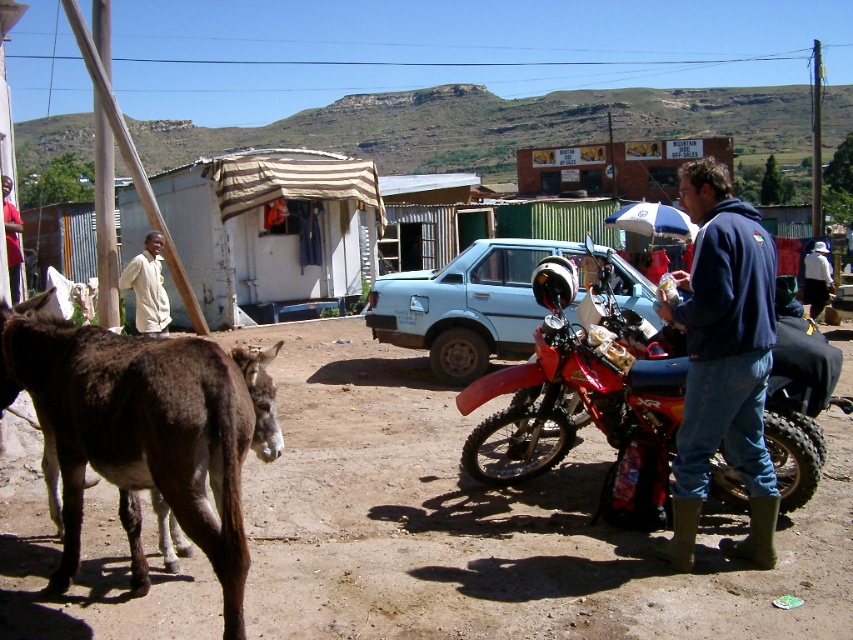
Find the location of a particular element. The height and width of the screenshot is (640, 853). red matte dirt bike at center is located at coordinates (584, 397).

Between white fabric hat at upper center and brushed metal water at bottle left, which one appears on the left side from the viewer's perspective?

brushed metal water at bottle left

Who is higher up, white fabric hat at upper center or brushed metal water at bottle left?

white fabric hat at upper center

Identify the location of white fabric hat at upper center. (816, 278).

The image size is (853, 640). In order to click on white fabric hat at upper center in this screenshot , I will do `click(816, 278)`.

Does point (604, 456) come farther from viewer compared to point (579, 292)?

That is False.

Which is in front, point (813, 596) or point (410, 323)?

Point (813, 596)

Find the location of a particular element. Image resolution: width=853 pixels, height=640 pixels. dirt track at center is located at coordinates (489, 524).

Image resolution: width=853 pixels, height=640 pixels. What are the coordinates of `dirt track at center` in the screenshot? It's located at (489, 524).